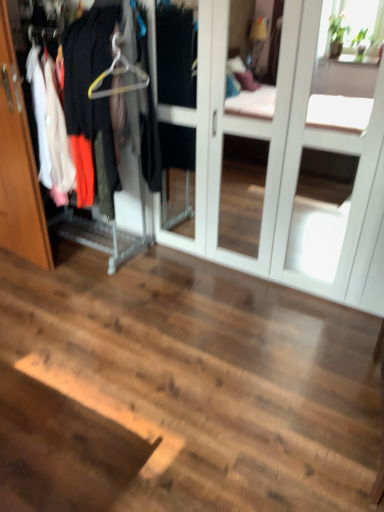
Question: In the image, is white glossy screen door at center on the left side or the right side of metallic hanger at left?

Choices:
 (A) right
 (B) left

Answer: (A)

Question: From a real-world perspective, relative to metallic hanger at left, is white glossy screen door at center vertically above or below?

Choices:
 (A) below
 (B) above

Answer: (A)

Question: Which object is positioned farthest from the wooden door at left?

Choices:
 (A) yellow plastic hanger at upper left
 (B) metallic hanger at left
 (C) white glossy screen door at center

Answer: (C)

Question: Considering the real-world distances, which object is closest to the wooden door at left?

Choices:
 (A) yellow plastic hanger at upper left
 (B) white glossy screen door at center
 (C) metallic hanger at left

Answer: (C)